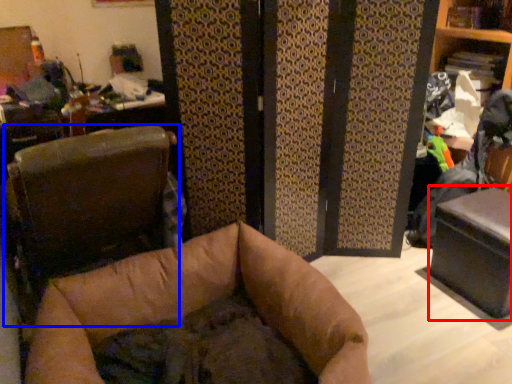
Question: Which point is further to the camera, table (highlighted by a red box) or furniture (highlighted by a blue box)?

Choices:
 (A) table
 (B) furniture

Answer: (A)